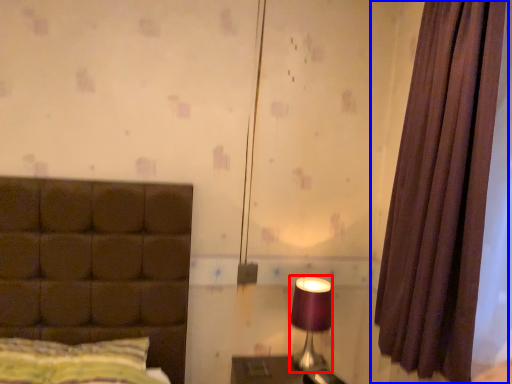
Question: Which of the following is the farthest to the observer, table lamp (highlighted by a red box) or curtain (highlighted by a blue box)?

Choices:
 (A) table lamp
 (B) curtain

Answer: (A)